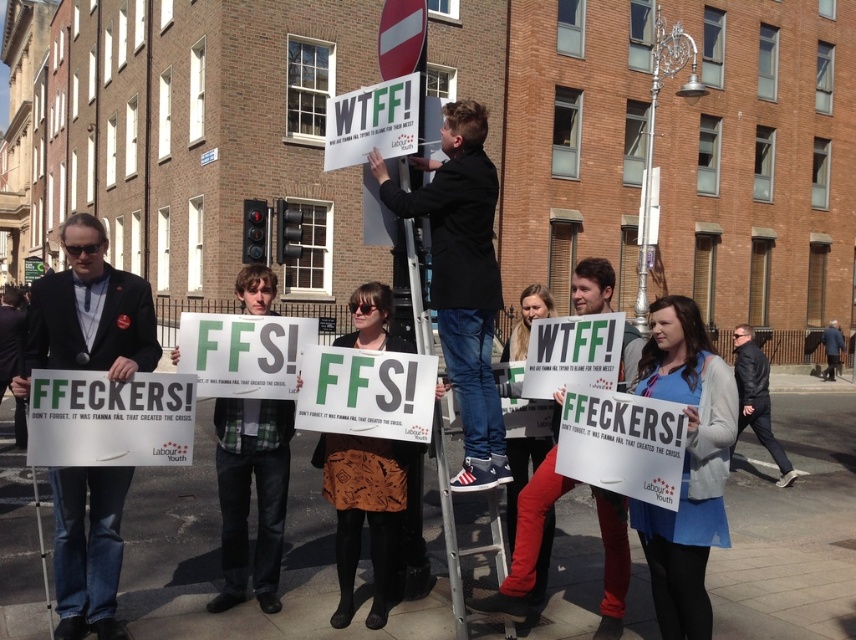
You are a photographer standing at the front of the protest group. You want to take a photo of the dark blue jeans at center and the matte black jacket at left. Which object should you move closer to the front to ensure both are visible?

The dark blue jeans at center is behind the matte black jacket at left, so you should move the dark blue jeans at center forward to ensure both are visible.

You are a photographer standing at the edge of the protest group. You want to take a photo that includes both the black leather jacket at center and the dark blue wool coat at lower right. Which of the two clothing items will appear larger in the photo?

The black leather jacket at center will appear larger in the photo because it is much taller than the dark blue wool coat at lower right.